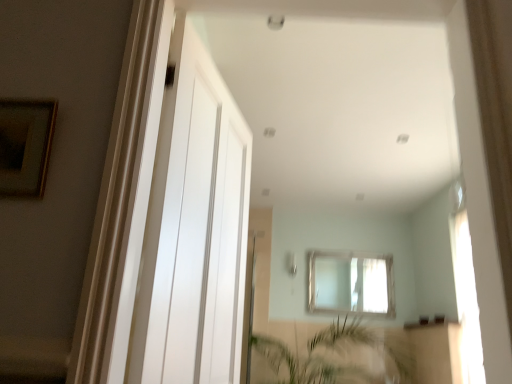
Locate an element on the screen. blank space above clear glass window at center (from a real-world perspective) is located at coordinates (349, 256).